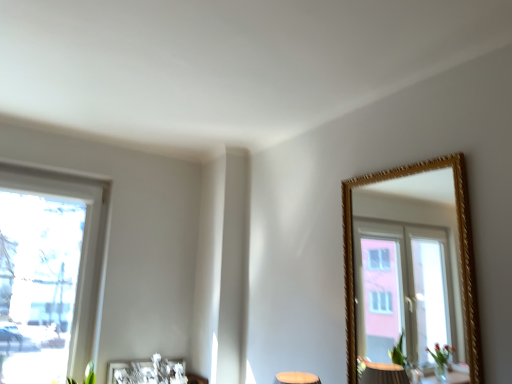
Question: From a real-world perspective, is white plastic window at left under metallic silver picture frame at lower center?

Choices:
 (A) no
 (B) yes

Answer: (A)

Question: Can you confirm if white plastic window at left is bigger than metallic silver picture frame at lower center?

Choices:
 (A) yes
 (B) no

Answer: (A)

Question: Would you say white plastic window at left is a long distance from metallic silver picture frame at lower center?

Choices:
 (A) no
 (B) yes

Answer: (A)

Question: Is white plastic window at left at the right side of metallic silver picture frame at lower center?

Choices:
 (A) yes
 (B) no

Answer: (B)

Question: Does white plastic window at left have a greater width compared to metallic silver picture frame at lower center?

Choices:
 (A) no
 (B) yes

Answer: (B)

Question: From a real-world perspective, is white plastic window at left positioned over metallic silver picture frame at lower center based on gravity?

Choices:
 (A) yes
 (B) no

Answer: (A)

Question: From a real-world perspective, is metallic silver picture frame at lower center positioned under white plastic window at left based on gravity?

Choices:
 (A) no
 (B) yes

Answer: (B)

Question: Considering the relative sizes of metallic silver picture frame at lower center and white plastic window at left in the image provided, is metallic silver picture frame at lower center shorter than white plastic window at left?

Choices:
 (A) yes
 (B) no

Answer: (A)

Question: From a real-world perspective, is metallic silver picture frame at lower center located higher than white plastic window at left?

Choices:
 (A) no
 (B) yes

Answer: (A)

Question: From the image's perspective, is metallic silver picture frame at lower center on top of white plastic window at left?

Choices:
 (A) yes
 (B) no

Answer: (B)

Question: Is metallic silver picture frame at lower center turned away from white plastic window at left?

Choices:
 (A) yes
 (B) no

Answer: (B)

Question: Does metallic silver picture frame at lower center have a greater width compared to white plastic window at left?

Choices:
 (A) yes
 (B) no

Answer: (B)

Question: Looking at their shapes, would you say metallic silver picture frame at lower center is wider or thinner than white plastic window at left?

Choices:
 (A) thin
 (B) wide

Answer: (A)